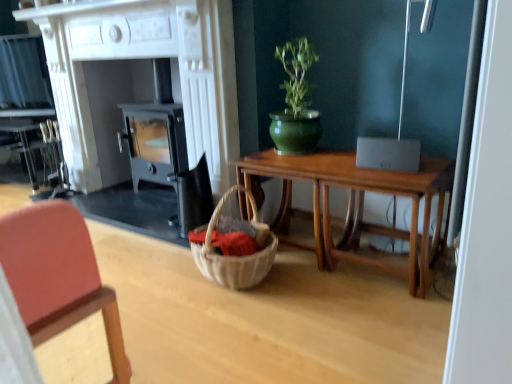
Question: Considering the relative sizes of white wood fireplace at center and wooden table at center in the image provided, is white wood fireplace at center wider than wooden table at center?

Choices:
 (A) yes
 (B) no

Answer: (A)

Question: Is white wood fireplace at center taller than wooden table at center?

Choices:
 (A) no
 (B) yes

Answer: (B)

Question: Does white wood fireplace at center have a larger size compared to wooden table at center?

Choices:
 (A) yes
 (B) no

Answer: (A)

Question: Are white wood fireplace at center and wooden table at center making contact?

Choices:
 (A) no
 (B) yes

Answer: (A)

Question: Is white wood fireplace at center thinner than wooden table at center?

Choices:
 (A) yes
 (B) no

Answer: (B)

Question: Looking at the image, does wooden table at center seem bigger or smaller compared to white wood fireplace at center?

Choices:
 (A) big
 (B) small

Answer: (B)

Question: From the image's perspective, is wooden table at center positioned above or below white wood fireplace at center?

Choices:
 (A) below
 (B) above

Answer: (A)

Question: Considering the positions of point (347, 168) and point (90, 187), is point (347, 168) closer or farther from the camera than point (90, 187)?

Choices:
 (A) closer
 (B) farther

Answer: (A)

Question: Based on their positions, is wooden table at center located to the left or right of white wood fireplace at center?

Choices:
 (A) left
 (B) right

Answer: (B)

Question: Would you say green glossy vase at upper center is inside or outside white wood fireplace at center?

Choices:
 (A) outside
 (B) inside

Answer: (A)

Question: In the image, is green glossy vase at upper center positioned in front of or behind white wood fireplace at center?

Choices:
 (A) behind
 (B) front

Answer: (A)

Question: Considering the positions of point (285, 129) and point (82, 81), is point (285, 129) closer or farther from the camera than point (82, 81)?

Choices:
 (A) farther
 (B) closer

Answer: (B)

Question: Considering the positions of green glossy vase at upper center and white wood fireplace at center in the image, is green glossy vase at upper center taller or shorter than white wood fireplace at center?

Choices:
 (A) tall
 (B) short

Answer: (B)

Question: Does point (81, 148) appear closer or farther from the camera than point (291, 97)?

Choices:
 (A) closer
 (B) farther

Answer: (B)

Question: Considering their positions, is white wood fireplace at center located in front of or behind green glossy vase at upper center?

Choices:
 (A) behind
 (B) front

Answer: (B)